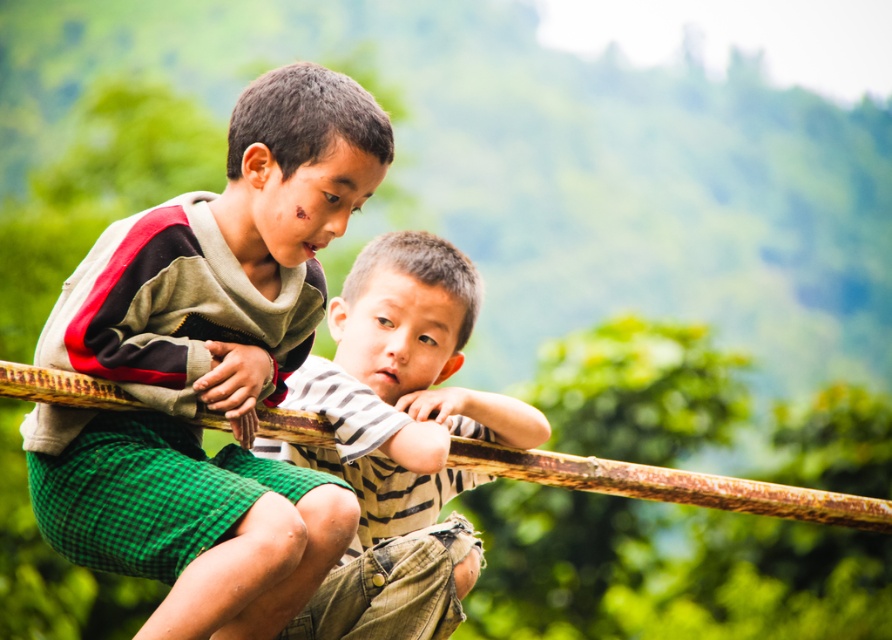
Question: Is green plaid shorts at center below striped cotton shirt at center?

Choices:
 (A) yes
 (B) no

Answer: (B)

Question: Is green plaid shorts at center positioned in front of striped cotton shirt at center?

Choices:
 (A) yes
 (B) no

Answer: (A)

Question: Which point is farther to the camera?

Choices:
 (A) pos(319,616)
 (B) pos(246,394)

Answer: (A)

Question: Does green plaid shorts at center appear under striped cotton shirt at center?

Choices:
 (A) no
 (B) yes

Answer: (A)

Question: Which point is closer to the camera?

Choices:
 (A) striped cotton shirt at center
 (B) green plaid shorts at center

Answer: (B)